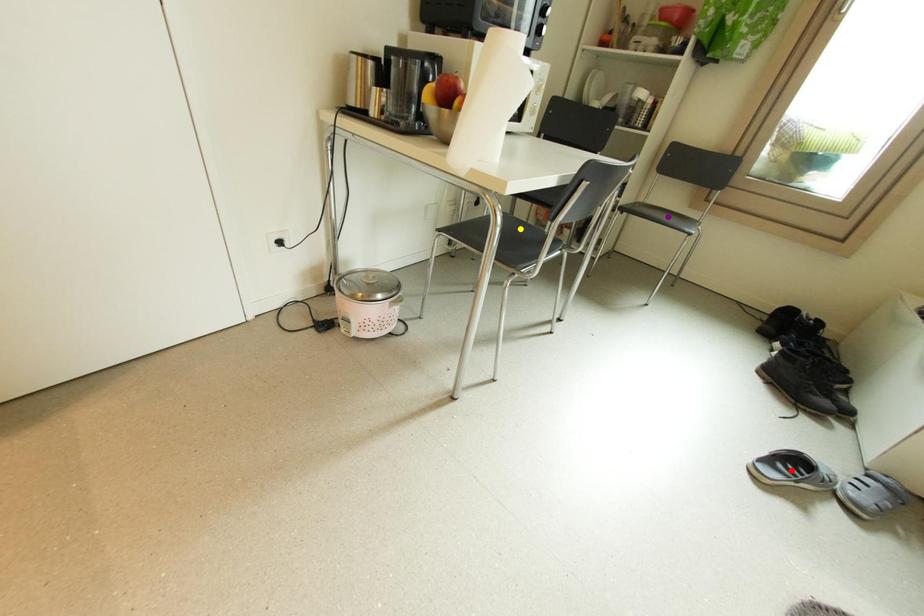
Order these from nearest to farthest:
yellow point
red point
purple point

purple point → red point → yellow point